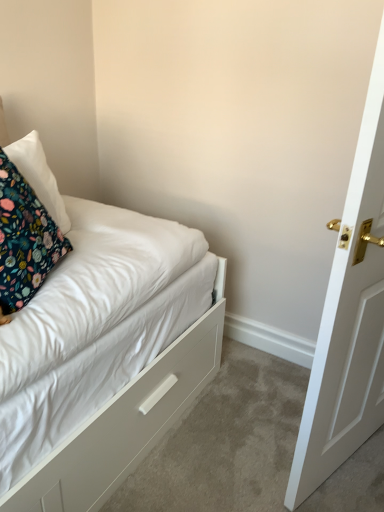
What do you see at coordinates (24, 240) in the screenshot?
I see `floral fabric pillow at left, acting as the 2th pillow starting from the back` at bounding box center [24, 240].

The width and height of the screenshot is (384, 512). Find the location of `white matte drawer at lower left`. white matte drawer at lower left is located at coordinates (123, 426).

Who is smaller, white matte drawer at lower left or floral fabric pillow at left, acting as the 2th pillow starting from the back?

Smaller between the two is floral fabric pillow at left, acting as the 2th pillow starting from the back.

In terms of height, does white matte drawer at lower left look taller or shorter compared to floral fabric pillow at left, acting as the 2th pillow starting from the back?

white matte drawer at lower left is shorter than floral fabric pillow at left, acting as the 2th pillow starting from the back.

From the image's perspective, between white matte drawer at lower left and floral fabric pillow at left, acting as the 2th pillow starting from the back, who is located below?

white matte drawer at lower left, from the image's perspective.

Which of these two, floral fabric pillow at left, the first pillow viewed from the front, or floral fabric pillow at upper left, the first pillow from the back, is thinner?

Thinner between the two is floral fabric pillow at left, the first pillow viewed from the front.

Find the location of `pillow located above the floral fabric pillow at left, acting as the 2th pillow starting from the back (from the image's perspective)`. pillow located above the floral fabric pillow at left, acting as the 2th pillow starting from the back (from the image's perspective) is located at coordinates (39, 176).

How many degrees apart are the facing directions of floral fabric pillow at left, the first pillow viewed from the front, and floral fabric pillow at upper left, the first pillow from the back?

The angle between the facing direction of floral fabric pillow at left, the first pillow viewed from the front, and the facing direction of floral fabric pillow at upper left, the first pillow from the back, is 16.7 degrees.

Measure the distance from floral fabric pillow at upper left, the 2th pillow positioned from the front, to floral fabric pillow at left, acting as the 2th pillow starting from the back.

A distance of 9.89 inches exists between floral fabric pillow at upper left, the 2th pillow positioned from the front, and floral fabric pillow at left, acting as the 2th pillow starting from the back.

Would you say floral fabric pillow at left, acting as the 2th pillow starting from the back, is part of floral fabric pillow at upper left, the 2th pillow positioned from the front,'s contents?

Definitely not — floral fabric pillow at left, acting as the 2th pillow starting from the back, is not inside floral fabric pillow at upper left, the 2th pillow positioned from the front.

Is floral fabric pillow at upper left, the first pillow from the back, taller or shorter than floral fabric pillow at left, acting as the 2th pillow starting from the back?

Considering their sizes, floral fabric pillow at upper left, the first pillow from the back, has less height than floral fabric pillow at left, acting as the 2th pillow starting from the back.

Can you confirm if floral fabric pillow at left, the first pillow viewed from the front, is positioned to the right of white matte drawer at lower left?

In fact, floral fabric pillow at left, the first pillow viewed from the front, is to the left of white matte drawer at lower left.

Considering the relative sizes of floral fabric pillow at left, the first pillow viewed from the front, and white matte drawer at lower left in the image provided, is floral fabric pillow at left, the first pillow viewed from the front, taller than white matte drawer at lower left?

Correct, floral fabric pillow at left, the first pillow viewed from the front, is much taller as white matte drawer at lower left.

Consider the image. From a real-world perspective, which object stands above the other?

floral fabric pillow at left, the first pillow viewed from the front, is physically above.

Identify the location of the 1st pillow positioned above the white matte drawer at lower left (from a real-world perspective). click(24, 240).

From a real-world perspective, is white matte drawer at lower left beneath floral fabric pillow at upper left, the first pillow from the back?

Yes, from a real-world perspective, white matte drawer at lower left is under floral fabric pillow at upper left, the first pillow from the back.

From the picture: Considering the sizes of white matte drawer at lower left and floral fabric pillow at upper left, the 2th pillow positioned from the front, in the image, is white matte drawer at lower left wider or thinner than floral fabric pillow at upper left, the 2th pillow positioned from the front,?

Clearly, white matte drawer at lower left has more width compared to floral fabric pillow at upper left, the 2th pillow positioned from the front.

From the image's perspective, is white matte drawer at lower left on floral fabric pillow at upper left, the 2th pillow positioned from the front?

No, from the image's perspective, white matte drawer at lower left is not above floral fabric pillow at upper left, the 2th pillow positioned from the front.

Can you confirm if white matte drawer at lower left is bigger than floral fabric pillow at upper left, the 2th pillow positioned from the front?

Yes, white matte drawer at lower left is bigger than floral fabric pillow at upper left, the 2th pillow positioned from the front.

Consider the image. Is floral fabric pillow at upper left, the 2th pillow positioned from the front, in front of or behind white matte drawer at lower left in the image?

In the image, floral fabric pillow at upper left, the 2th pillow positioned from the front, appears behind white matte drawer at lower left.

Which of these two, floral fabric pillow at upper left, the 2th pillow positioned from the front, or white matte drawer at lower left, stands taller?

floral fabric pillow at upper left, the 2th pillow positioned from the front.

From a real-world perspective, who is located higher, floral fabric pillow at upper left, the first pillow from the back, or white matte drawer at lower left?

In real-world perspective, floral fabric pillow at upper left, the first pillow from the back, is above.

You are a GUI agent. You are given a task and a screenshot of the screen. Output one action in this format:
    pyautogui.click(x=<x>, y=<y>)
    Task: Click on the 1st pillow positioned above the white matte drawer at lower left (from the image's perspective)
    The image size is (384, 512).
    Given the screenshot: What is the action you would take?
    pyautogui.click(x=24, y=240)

Locate an element on the screen. Image resolution: width=384 pixels, height=512 pixels. pillow on the left of floral fabric pillow at left, the first pillow viewed from the front is located at coordinates pyautogui.click(x=39, y=176).

Which object lies further to the anchor point white matte drawer at lower left, floral fabric pillow at left, the first pillow viewed from the front, or floral fabric pillow at upper left, the first pillow from the back?

floral fabric pillow at upper left, the first pillow from the back, lies further to white matte drawer at lower left than the other object.

Based on their spatial positions, is white matte drawer at lower left or floral fabric pillow at upper left, the first pillow from the back, further from floral fabric pillow at left, acting as the 2th pillow starting from the back?

Among the two, white matte drawer at lower left is located further to floral fabric pillow at left, acting as the 2th pillow starting from the back.

Considering their positions, is floral fabric pillow at upper left, the 2th pillow positioned from the front, positioned further to floral fabric pillow at left, the first pillow viewed from the front, than white matte drawer at lower left?

Among the two, white matte drawer at lower left is located further to floral fabric pillow at left, the first pillow viewed from the front.

From the image, which object appears to be farther from floral fabric pillow at upper left, the 2th pillow positioned from the front, floral fabric pillow at left, the first pillow viewed from the front, or white matte drawer at lower left?

Among the two, white matte drawer at lower left is located further to floral fabric pillow at upper left, the 2th pillow positioned from the front.

Based on their spatial positions, is white matte drawer at lower left or floral fabric pillow at left, the first pillow viewed from the front, closer to floral fabric pillow at upper left, the first pillow from the back?

Among the two, floral fabric pillow at left, the first pillow viewed from the front, is located nearer to floral fabric pillow at upper left, the first pillow from the back.

Which object lies nearer to the anchor point white matte drawer at lower left, floral fabric pillow at upper left, the 2th pillow positioned from the front, or floral fabric pillow at left, the first pillow viewed from the front?

The object closer to white matte drawer at lower left is floral fabric pillow at left, the first pillow viewed from the front.

You are a GUI agent. You are given a task and a screenshot of the screen. Output one action in this format:
    pyautogui.click(x=<x>, y=<y>)
    Task: Click on the pillow between floral fabric pillow at upper left, the first pillow from the back, and white matte drawer at lower left, in the vertical direction
    Image resolution: width=384 pixels, height=512 pixels.
    Given the screenshot: What is the action you would take?
    pyautogui.click(x=24, y=240)